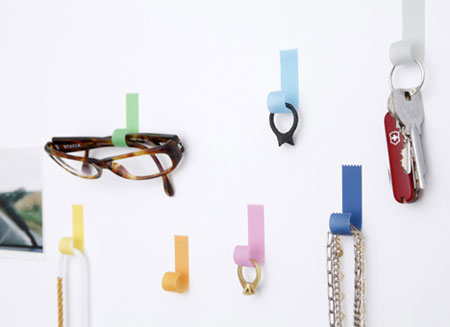
Locate an element on the screen. This screenshot has height=327, width=450. light blue hook is located at coordinates pyautogui.click(x=285, y=71).